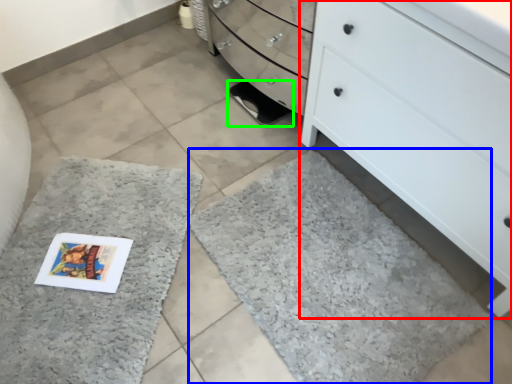
Question: Which object is positioned farthest from chest of drawers (highlighted by a red box)? Select from bath mat (highlighted by a blue box) and footwear (highlighted by a green box).

Choices:
 (A) bath mat
 (B) footwear

Answer: (B)